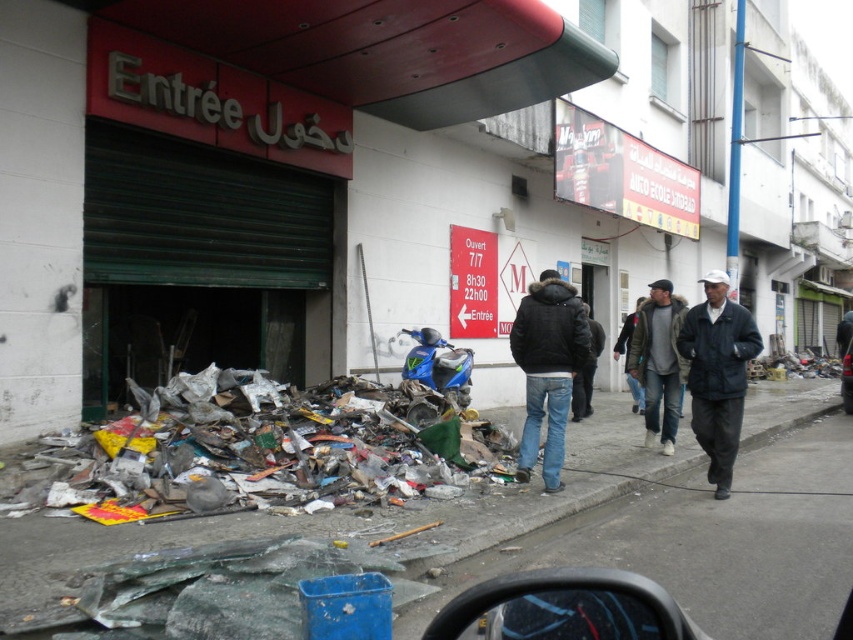
Question: Among these points, which one is nearest to the camera?

Choices:
 (A) (840, 392)
 (B) (746, 344)
 (C) (653, 440)
 (D) (830, 464)

Answer: (B)

Question: Which point is farther to the camera?

Choices:
 (A) dark gray jacket at right
 (B) dark brown leather jacket at center

Answer: (B)

Question: From the image, what is the correct spatial relationship of broken glass pavement at lower left in relation to dark gray jacket at right?

Choices:
 (A) right
 (B) left

Answer: (A)

Question: Considering the relative positions of dark blue jacket at right and dark brown leather jacket at center in the image provided, where is dark blue jacket at right located with respect to dark brown leather jacket at center?

Choices:
 (A) left
 (B) right

Answer: (B)

Question: Is black matte jacket at center positioned in front of dark blue jacket at right?

Choices:
 (A) no
 (B) yes

Answer: (B)

Question: Which point is closer to the camera?

Choices:
 (A) (367, 470)
 (B) (705, 275)
 (C) (846, 401)

Answer: (A)